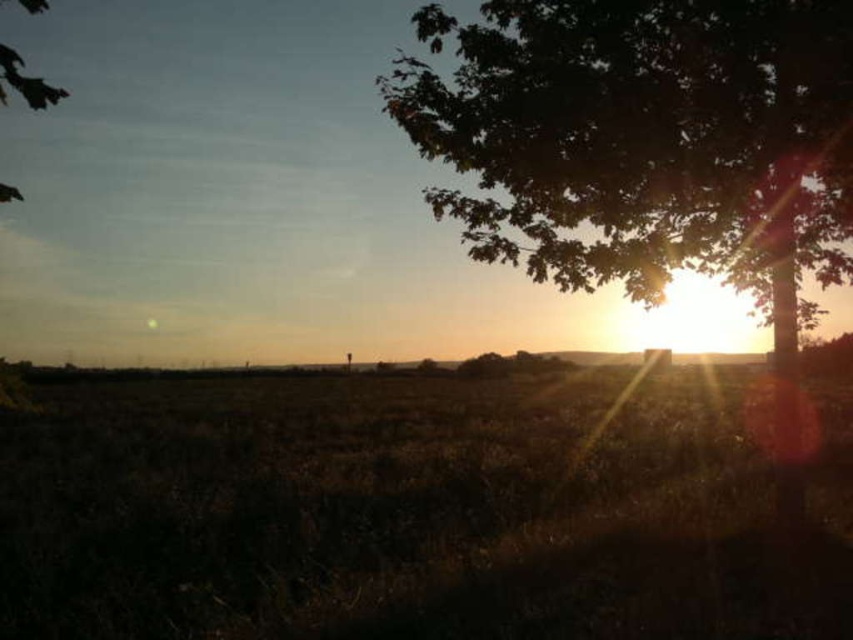
Does green leafy tree at upper right have a lesser width compared to green leafy tree at upper left?

Yes.

Between green leafy tree at upper right and green leafy tree at upper left, which one appears on the right side from the viewer's perspective?

green leafy tree at upper right

Is point (817, 280) positioned before point (47, 97)?

No, it is not.

Locate an element on the screen. green leafy tree at upper right is located at coordinates (645, 140).

Does brown grassy at center appear over green leafy tree at upper right?

Actually, brown grassy at center is below green leafy tree at upper right.

Is brown grassy at center bigger than green leafy tree at upper right?

Yes, brown grassy at center is bigger than green leafy tree at upper right.

What are the coordinates of `brown grassy at center` in the screenshot? It's located at (403, 513).

Identify the location of brown grassy at center. (403, 513).

What do you see at coordinates (403, 513) in the screenshot? I see `brown grassy at center` at bounding box center [403, 513].

Does brown grassy at center appear on the right side of green leafy tree at upper left?

Indeed, brown grassy at center is positioned on the right side of green leafy tree at upper left.

You are a GUI agent. You are given a task and a screenshot of the screen. Output one action in this format:
    pyautogui.click(x=<x>, y=<y>)
    Task: Click on the brown grassy at center
    The image size is (853, 640).
    Given the screenshot: What is the action you would take?
    pyautogui.click(x=403, y=513)

Image resolution: width=853 pixels, height=640 pixels. I want to click on brown grassy at center, so [x=403, y=513].